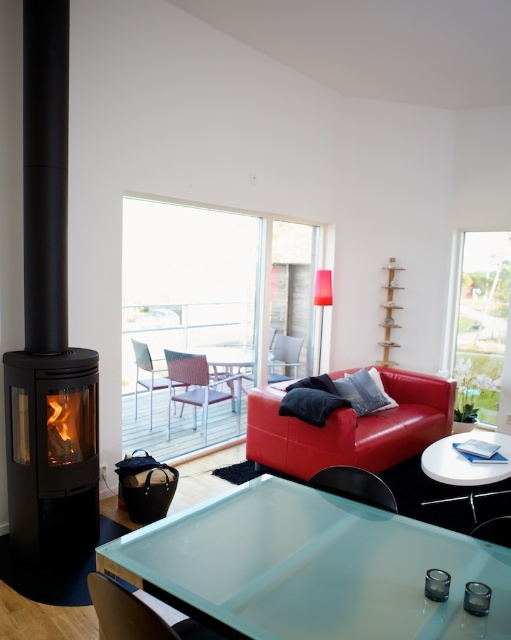
You are standing in the living room and want to place a small potted plant exactly at point (49, 324). What object will the plant be placed next to?

The plant will be placed next to the black matte fireplace at left, as that is the object located at point (49, 324).

You are planning to move a large potted plant that is 1.2 meters wide into this living room. There is space between the matte leather couch at center and the matte black armchair at lower left. Do you think the plant will fit in that space?

The space between the matte leather couch at center and the matte black armchair at lower left is wider than the plant since the couch is wider than the armchair. Therefore, the plant should fit comfortably in that space.

You are planning to place a new rectangular coffee table between the matte leather couch at center and the metallic silver armchair at center. The coffee table is 1.2 meters wide. Can the coffee table fit between them without being wider than the space available?

The matte leather couch at center is wider than the metallic silver armchair at center. However, the exact width of the space between them isn not specified in the provided information. Therefore, it is uncertain if the 1.2 meter wide coffee table will fit without further details about the available space.